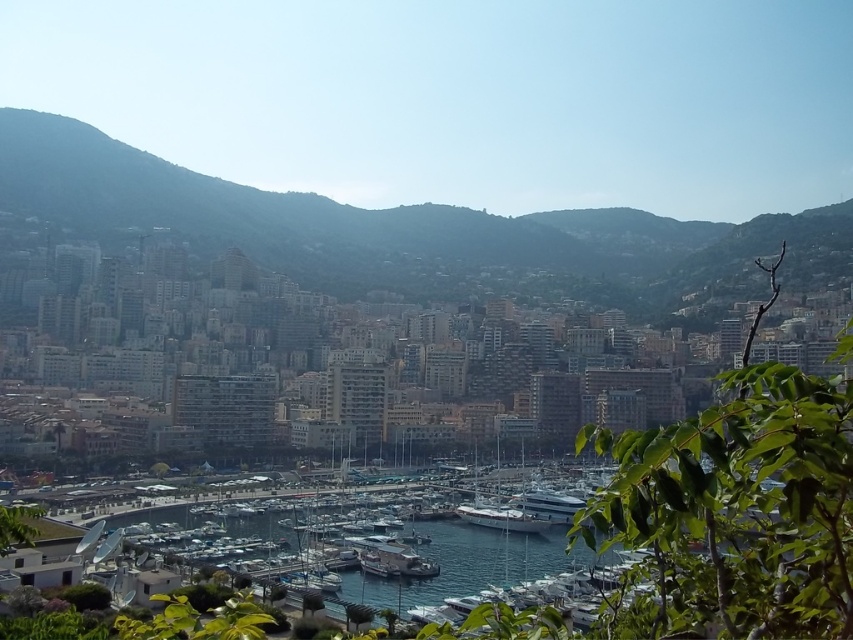
Can you confirm if green textured hillside at center is positioned to the right of clear blue water at lower center?

Incorrect, green textured hillside at center is not on the right side of clear blue water at lower center.

Looking at this image, is green textured hillside at center smaller than clear blue water at lower center?

Actually, green textured hillside at center might be larger than clear blue water at lower center.

Between point (396, 269) and point (534, 540), which one is positioned behind?

The point (396, 269) is more distant.

Locate an element on the screen. The height and width of the screenshot is (640, 853). green textured hillside at center is located at coordinates (403, 228).